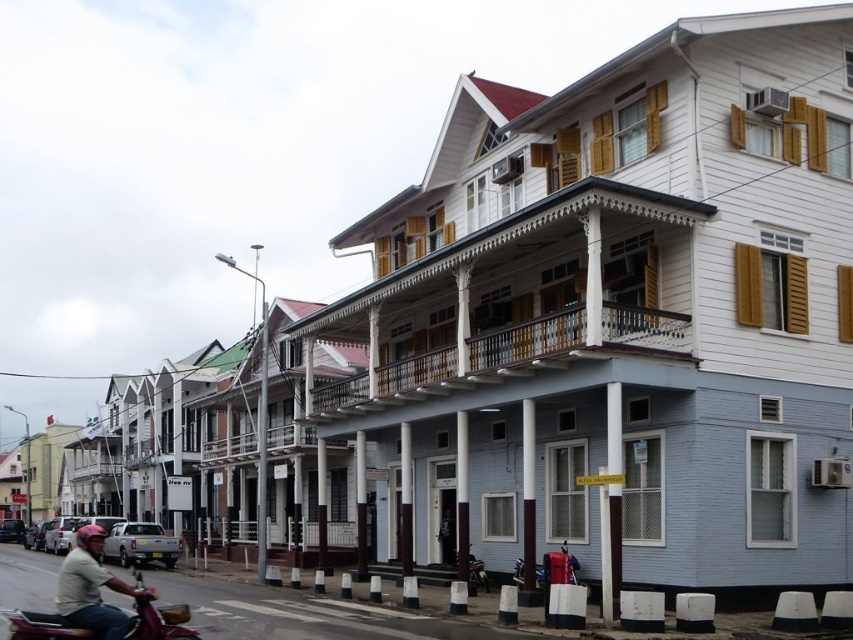
Question: Is the position of metallic maroon motorcycle at lower left less distant than that of light brown leather helmet at lower left?

Choices:
 (A) no
 (B) yes

Answer: (B)

Question: Does metallic maroon motorcycle at lower left have a lesser width compared to light brown leather helmet at lower left?

Choices:
 (A) no
 (B) yes

Answer: (B)

Question: Can you confirm if metallic maroon motorcycle at lower left is thinner than light brown leather helmet at lower left?

Choices:
 (A) no
 (B) yes

Answer: (B)

Question: Which point is closer to the camera?

Choices:
 (A) metallic maroon motorcycle at lower left
 (B) light brown leather helmet at lower left

Answer: (A)

Question: Which point appears closest to the camera in this image?

Choices:
 (A) (90, 602)
 (B) (73, 614)

Answer: (B)

Question: Among these objects, which one is nearest to the camera?

Choices:
 (A) metallic maroon motorcycle at lower left
 (B) light brown leather helmet at lower left

Answer: (A)